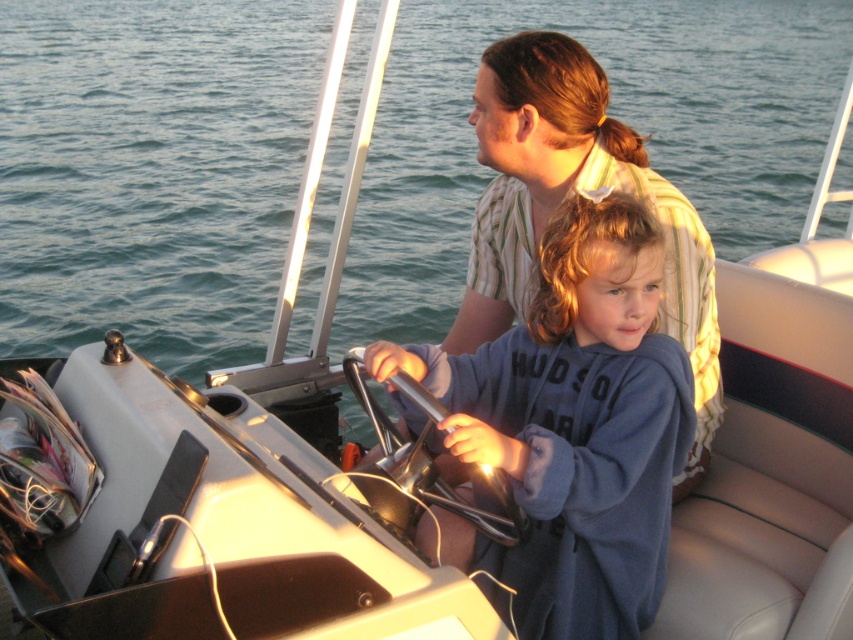
Question: Where is blue fleece jacket at center located in relation to matte striped shirt at center in the image?

Choices:
 (A) left
 (B) right

Answer: (A)

Question: Which point is farther from the camera taking this photo?

Choices:
 (A) (624, 365)
 (B) (601, 184)

Answer: (B)

Question: Does blue fleece jacket at center lie behind matte striped shirt at center?

Choices:
 (A) no
 (B) yes

Answer: (A)

Question: Can you confirm if blue fleece jacket at center is positioned below matte striped shirt at center?

Choices:
 (A) no
 (B) yes

Answer: (B)